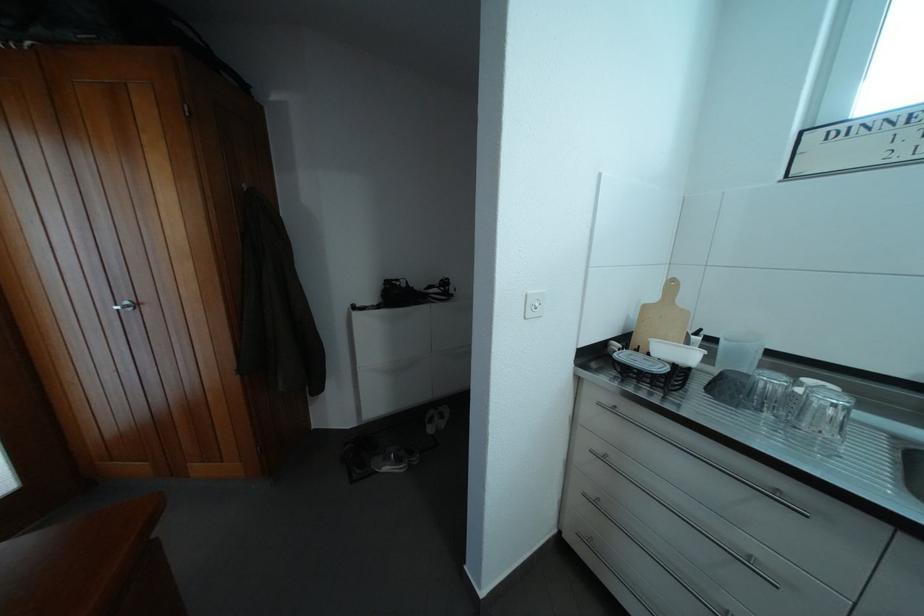
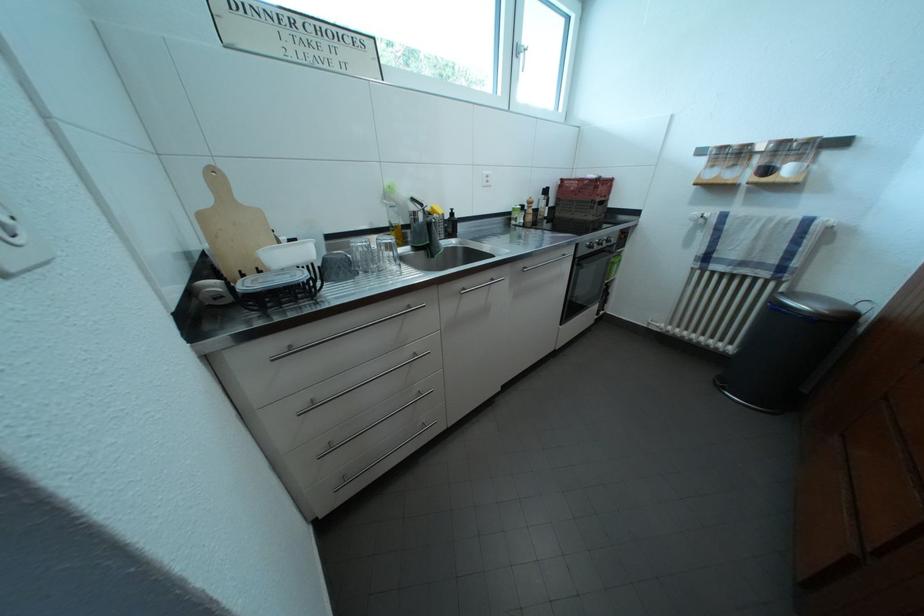
First-person continuous shooting, in which direction is the camera rotating?

The camera rotated toward right-down.